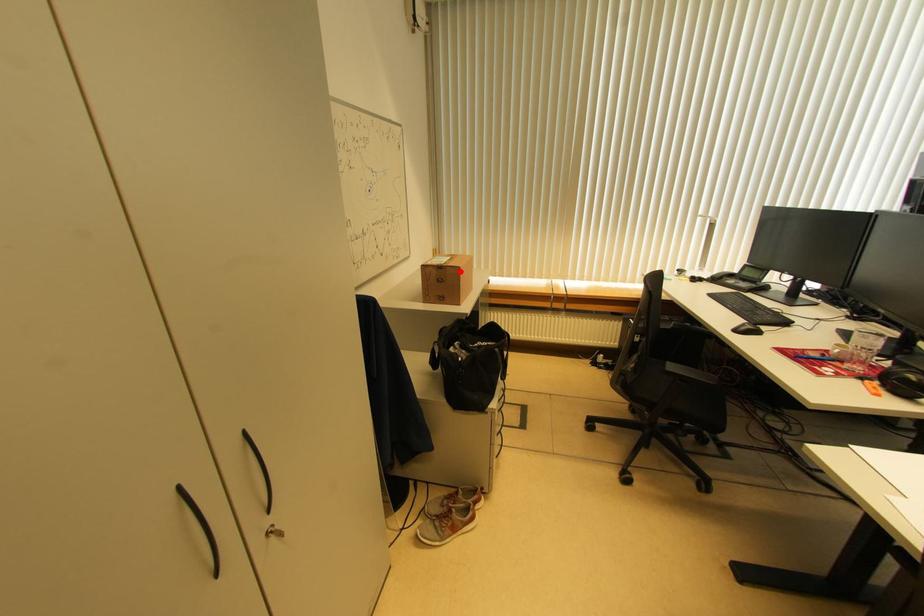
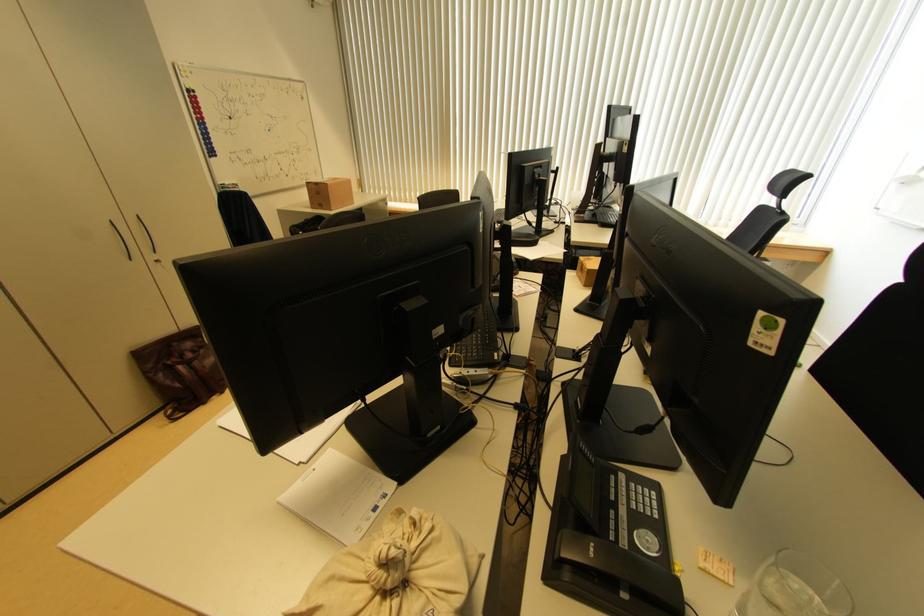
In the second image, find the point that corresponds to the highlighted location in the first image.

(329, 188)